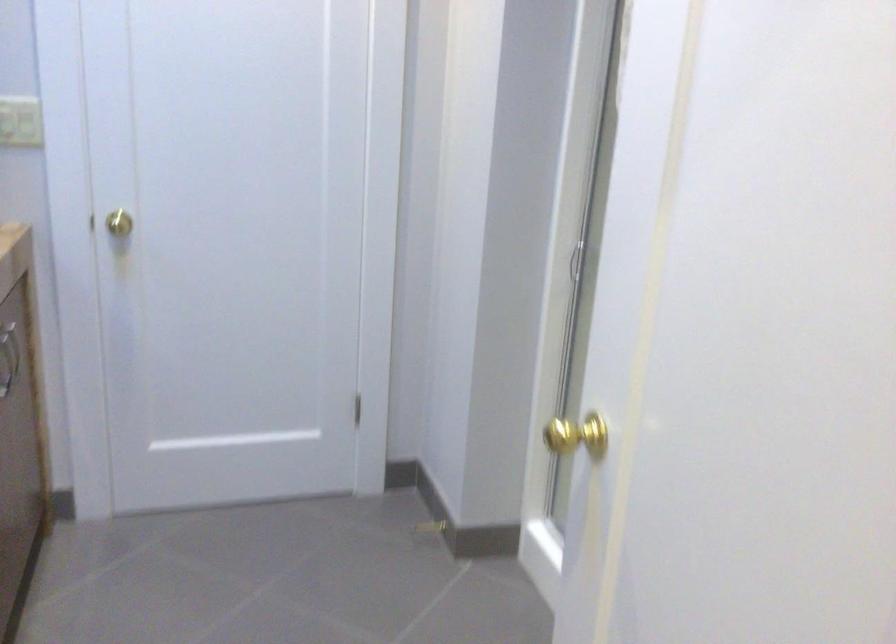
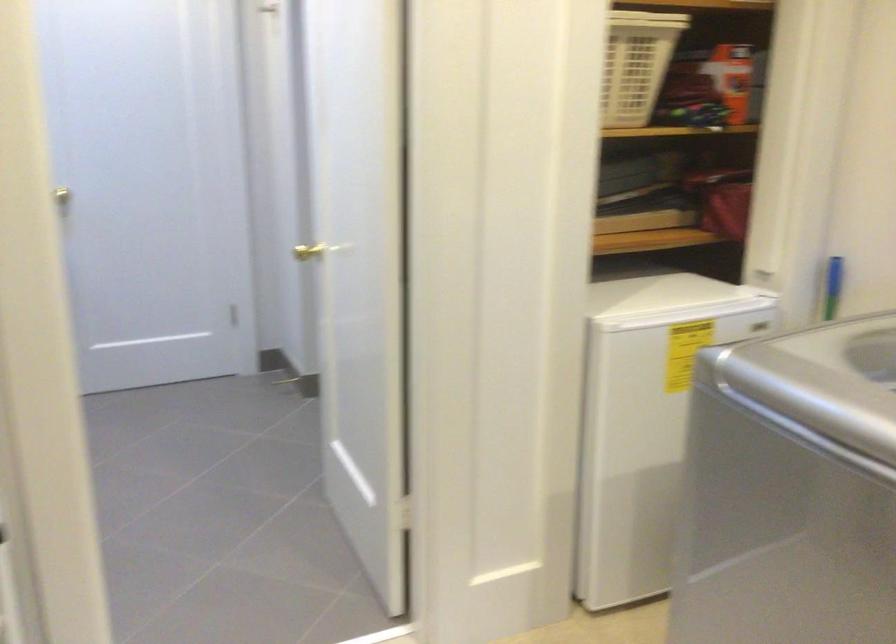
In the second image, find the point that corresponds to [115,223] in the first image.

(71, 192)